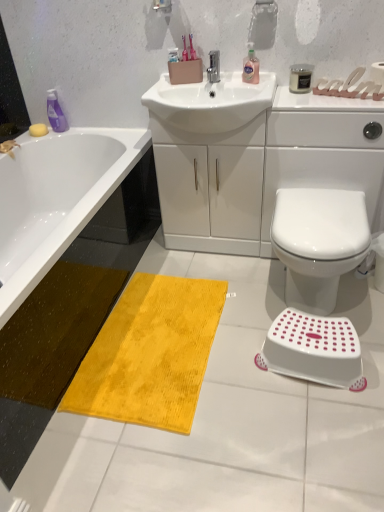
The width and height of the screenshot is (384, 512). I want to click on free point in front of yellow plush bath mat at center, so click(184, 452).